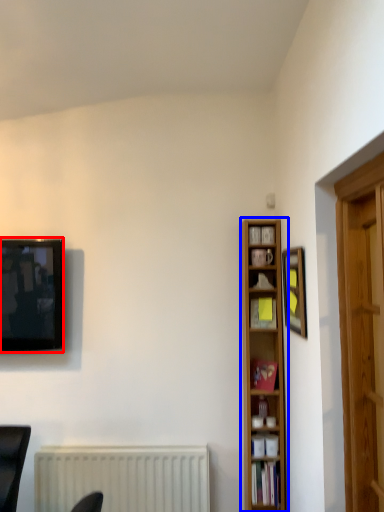
Question: Among these objects, which one is nearest to the camera, television (highlighted by a red box) or bookcase (highlighted by a blue box)?

Choices:
 (A) television
 (B) bookcase

Answer: (B)